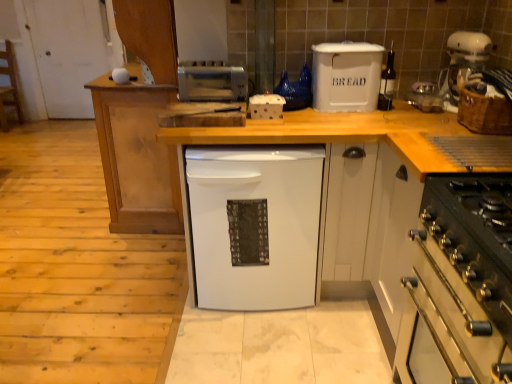
Question: From a real-world perspective, relative to white plastic container at center, which is counted as the second appliance, starting from the left, is woven brown basket at right vertically above or below?

Choices:
 (A) below
 (B) above

Answer: (B)

Question: Would you say woven brown basket at right is inside or outside white plastic container at center, positioned as the 3th appliance in right-to-left order?

Choices:
 (A) outside
 (B) inside

Answer: (A)

Question: Based on their relative distances, which object is nearer to the clear plastic container at upper right, which is the first appliance in right-to-left order?

Choices:
 (A) white wood countertop at center
 (B) white plastic coffee machine at upper right
 (C) satin silver toaster at upper center, acting as the first appliance starting from the left
 (D) white plastic container at center, which is counted as the second appliance, starting from the left
 (E) white matte dishwasher at center

Answer: (B)

Question: Estimate the real-world distances between objects in this image. Which object is closer to the black metallic oven at lower right?

Choices:
 (A) matte white wine bottle at center, the second appliance when ordered from right to left
 (B) white matte dishwasher at center
 (C) clear plastic container at upper right, the 4th appliance viewed from the left
 (D) white plastic bread bin at upper center
 (E) satin silver toaster at upper center, which is counted as the fourth appliance, starting from the right

Answer: (B)